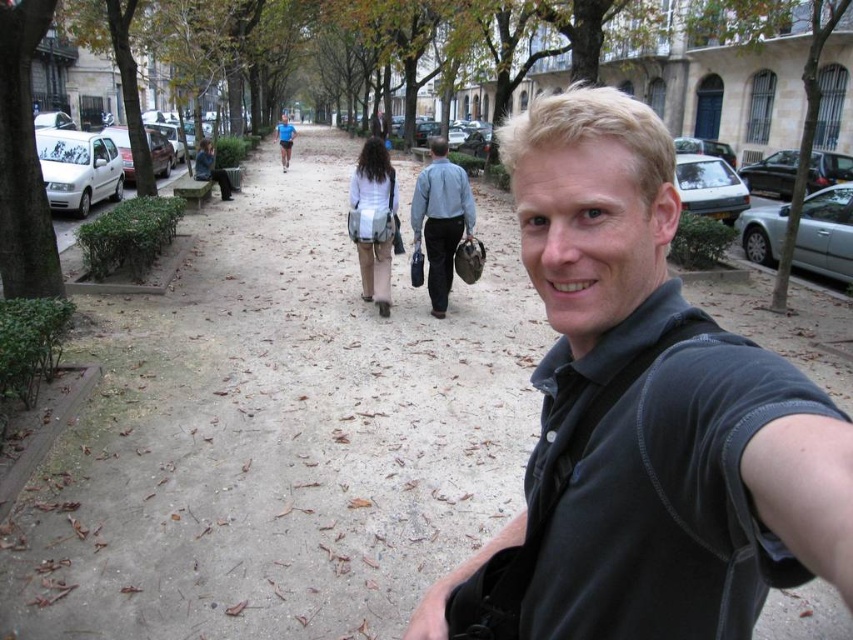
From the picture: What are the coordinates of the black matte shirt at center?

The black matte shirt at center is located at coordinates point (643,419).

You are standing at the position of the man taking the selfie and want to greet the two people wearing the black matte shirt at center and light blue shirt at center. Which one is farther away from you?

Both the black matte shirt at center and light blue shirt at center are 6.42 meters away from each other, but since you are at the selfie position, you need to calculate your distance to each. However, the given information only specifies the distance between them, not their positions relative to you. Without additional details about their placement along the path, it is impossible to determine which is farther away.

You are a photographer wanting to capture both the black matte shirt at center and the blue shirt at center in one frame. Given their heights, which one should you focus on to ensure both are fully visible in the photo?

The black matte shirt at center is shorter than the blue shirt at center. To ensure both are fully visible, focus on the blue shirt at center as it is taller, allowing the shorter black matte shirt at center to be captured within the frame.